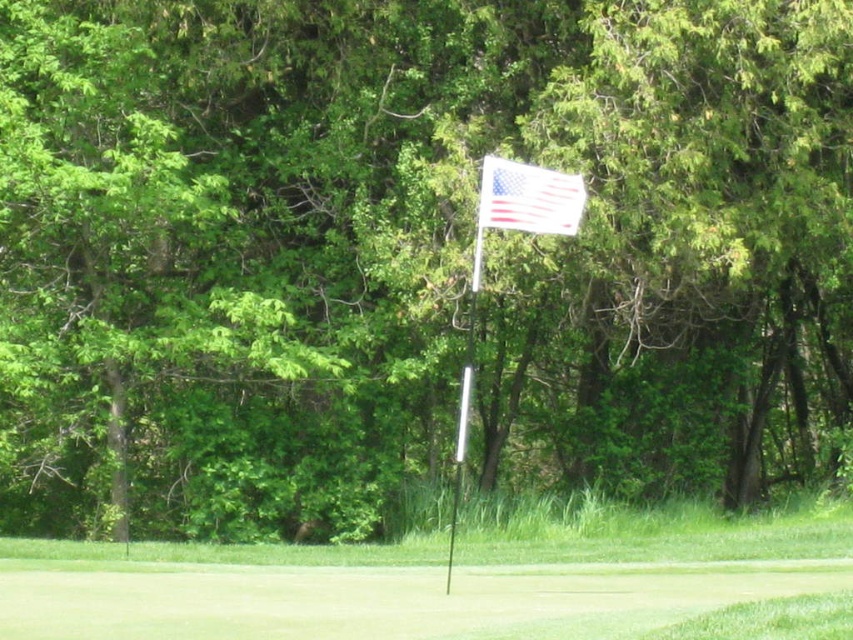
You are a golfer trying to determine which flag to aim for. You see the white plastic flag at center and the white fabric flag at upper center. Which flag is closer to you?

The white plastic flag at center is closer to you because it is in front of the white fabric flag at upper center.

You are a golfer trying to line up your shot. You notice two flags in the distance. The first is the white plastic flag at center, and the second is the white fabric flag at upper center. Which flag is shorter?

The white plastic flag at center is shorter than the white fabric flag at upper center.